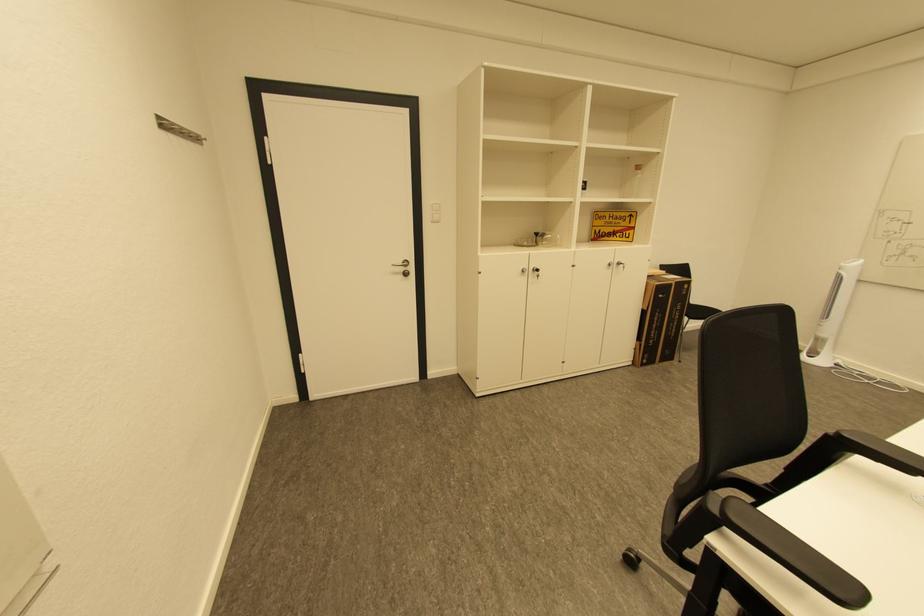
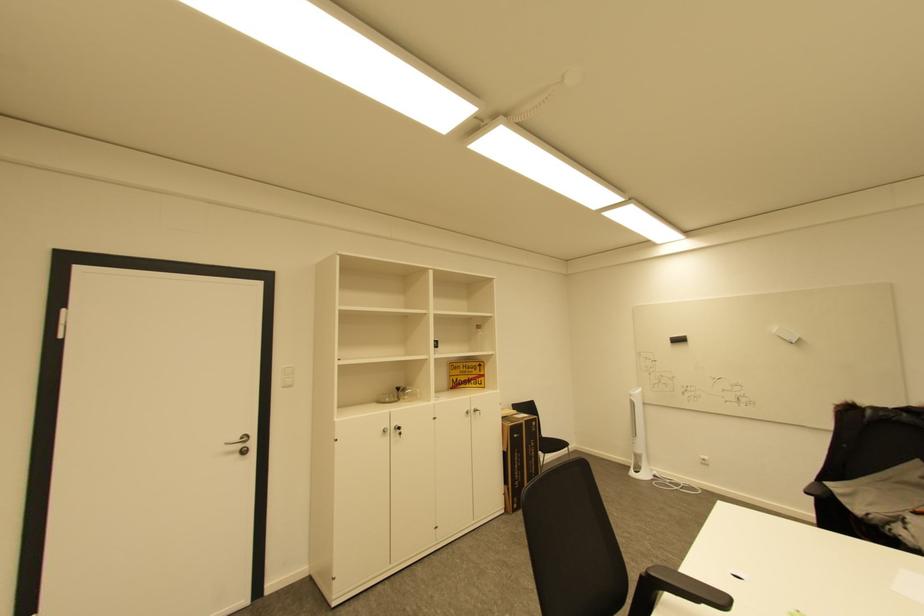
First-person continuous shooting, in which direction is the camera rotating?

The rotation direction of the camera is right-up.